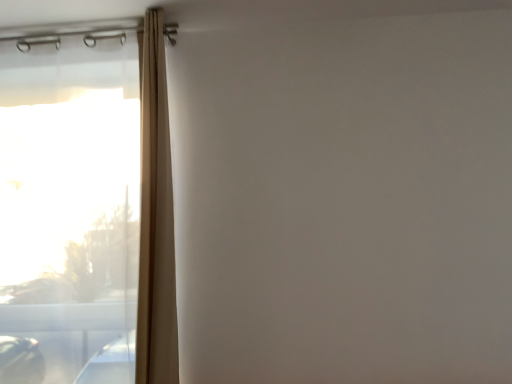
Question: Does transparent plastic window at left have a greater height compared to beige fabric curtain at left?

Choices:
 (A) no
 (B) yes

Answer: (B)

Question: Is transparent plastic window at left touching beige fabric curtain at left?

Choices:
 (A) no
 (B) yes

Answer: (A)

Question: Would you say beige fabric curtain at left is part of transparent plastic window at left's contents?

Choices:
 (A) yes
 (B) no

Answer: (B)

Question: Can you confirm if transparent plastic window at left is thinner than beige fabric curtain at left?

Choices:
 (A) yes
 (B) no

Answer: (A)

Question: Considering the relative sizes of transparent plastic window at left and beige fabric curtain at left in the image provided, is transparent plastic window at left smaller than beige fabric curtain at left?

Choices:
 (A) yes
 (B) no

Answer: (B)

Question: From a real-world perspective, is transparent plastic window at left located beneath beige fabric curtain at left?

Choices:
 (A) no
 (B) yes

Answer: (B)

Question: From a real-world perspective, is beige fabric curtain at left physically below transparent plastic window at left?

Choices:
 (A) no
 (B) yes

Answer: (A)

Question: Could transparent plastic window at left be considered to be inside beige fabric curtain at left?

Choices:
 (A) yes
 (B) no

Answer: (B)

Question: Is beige fabric curtain at left positioned beyond the bounds of transparent plastic window at left?

Choices:
 (A) no
 (B) yes

Answer: (B)

Question: Can you confirm if beige fabric curtain at left is wider than transparent plastic window at left?

Choices:
 (A) yes
 (B) no

Answer: (A)

Question: From the image's perspective, is beige fabric curtain at left on transparent plastic window at left?

Choices:
 (A) yes
 (B) no

Answer: (A)

Question: Is the depth of beige fabric curtain at left greater than that of transparent plastic window at left?

Choices:
 (A) no
 (B) yes

Answer: (A)

Question: Considering the positions of transparent plastic window at left and beige fabric curtain at left in the image, is transparent plastic window at left taller or shorter than beige fabric curtain at left?

Choices:
 (A) tall
 (B) short

Answer: (A)